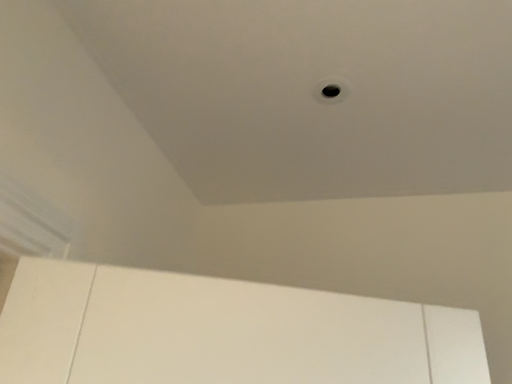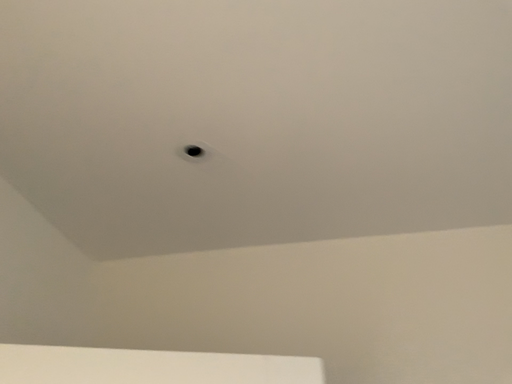
Question: How did the camera likely rotate when shooting the video?

Choices:
 (A) rotated left
 (B) rotated right

Answer: (B)